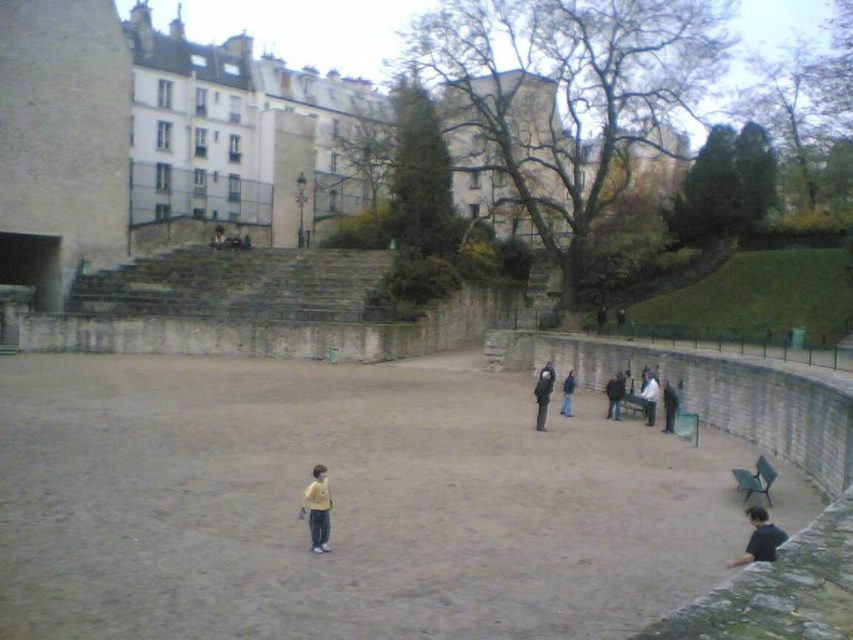
You are standing at the center of the amphitheater and want to find the dark blue shirt at lower right. Which direction should you move to locate it?

The dark blue shirt at lower right is located at point (759, 538), so you should move towards the lower right direction from the center to locate it.

You are a photographer trying to capture a shot of the dark blue jeans at lower right and the dark blue jacket at center. Which object should you focus on first if you want to prioritize the closer one?

The dark blue jeans at lower right should be focused on first because it has a lesser height compared to the dark blue jacket at center, indicating it is closer to the photographer.